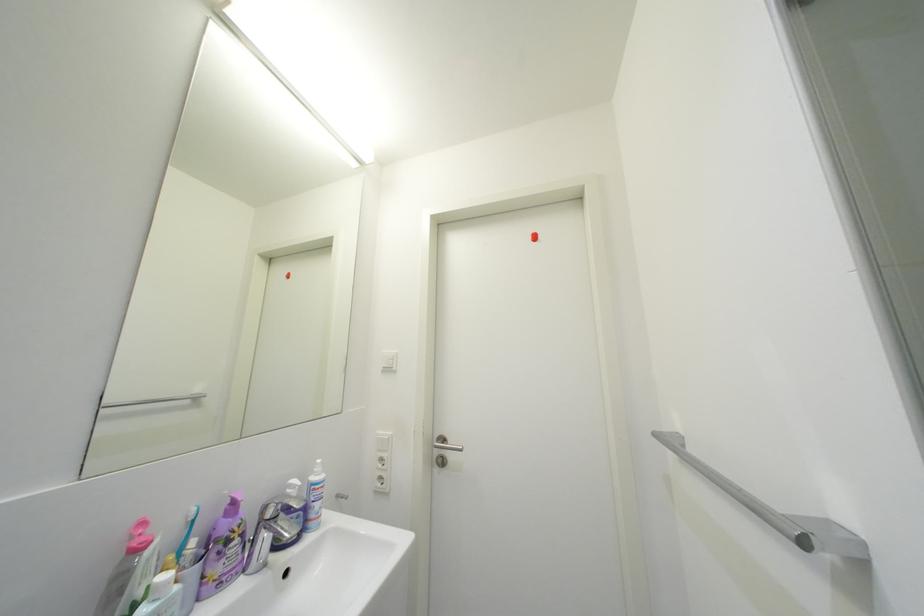
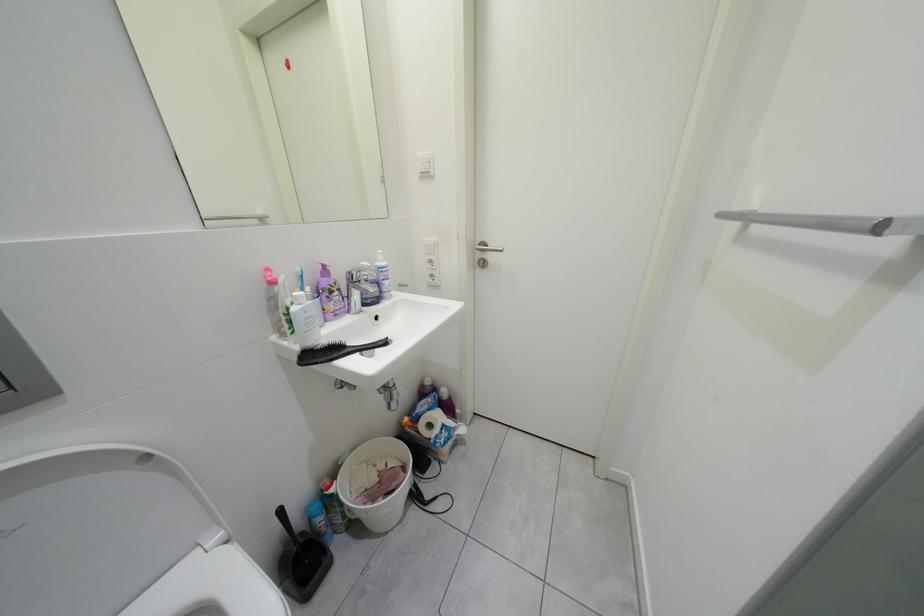
Question: How did the camera likely rotate?

Choices:
 (A) Left
 (B) Right
 (C) Up
 (D) Down

Answer: (D)